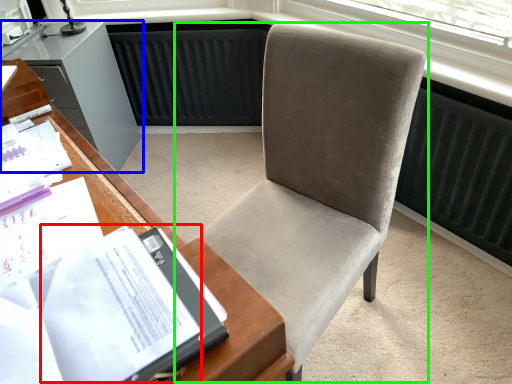
Question: Which is nearer to the journal (highlighted by a red box)? cabinetry (highlighted by a blue box) or chair (highlighted by a green box).

Choices:
 (A) cabinetry
 (B) chair

Answer: (B)